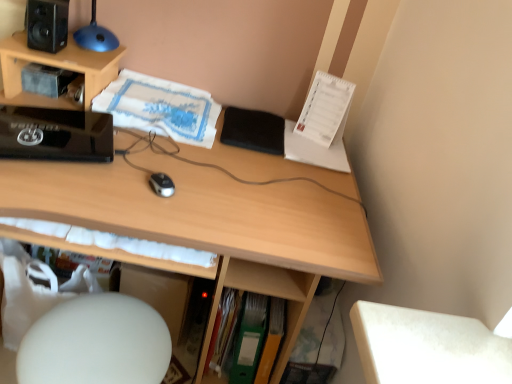
Question: Visually, is green matte folder at lower center, the second paperback book in the left-to-right sequence, positioned to the left or to the right of black plastic mouse at center?

Choices:
 (A) right
 (B) left

Answer: (A)

Question: Choose the correct answer: Is green matte folder at lower center, which is counted as the first paperback book, starting from the right, inside black plastic mouse at center or outside it?

Choices:
 (A) outside
 (B) inside

Answer: (A)

Question: Based on their relative distances, which object is farther from the wooden desk at center?

Choices:
 (A) green matte folder at lower center, the 2th book when ordered from top to bottom
 (B) green matte folder at lower center, which is counted as the first paperback book, starting from the right
 (C) white matte computer chair at lower left
 (D) glossy black computer at left
 (E) white paper at center, which ranks as the 1th book in left-to-right order

Answer: (B)

Question: Which object is positioned farthest from the black plastic mouse at center?

Choices:
 (A) white matte computer chair at lower left
 (B) green matte folder at lower center, the second paperback book in the left-to-right sequence
 (C) black matte notepad at center
 (D) green matte folder at lower center, the first book viewed from the right
 (E) white paper at center, which ranks as the 1th book in left-to-right order

Answer: (B)